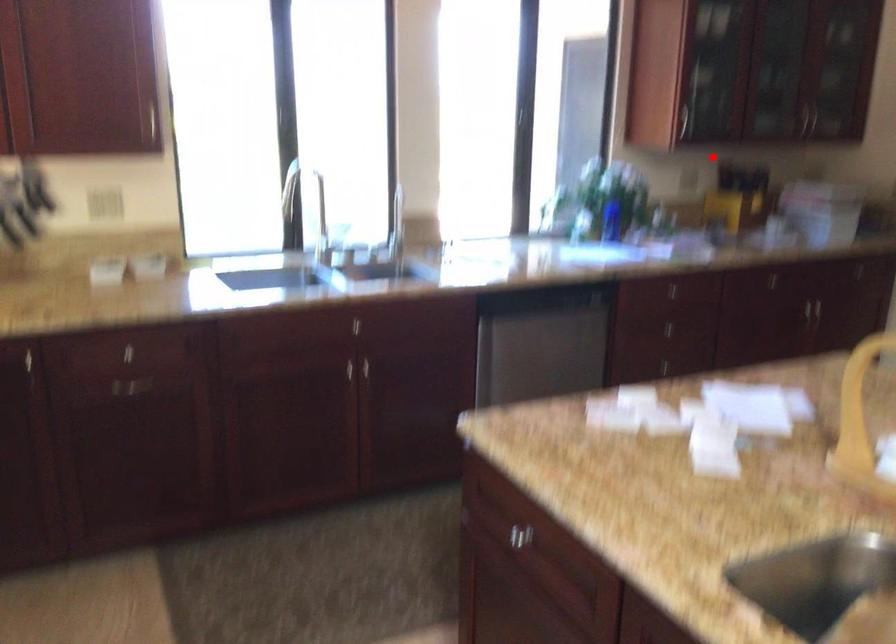
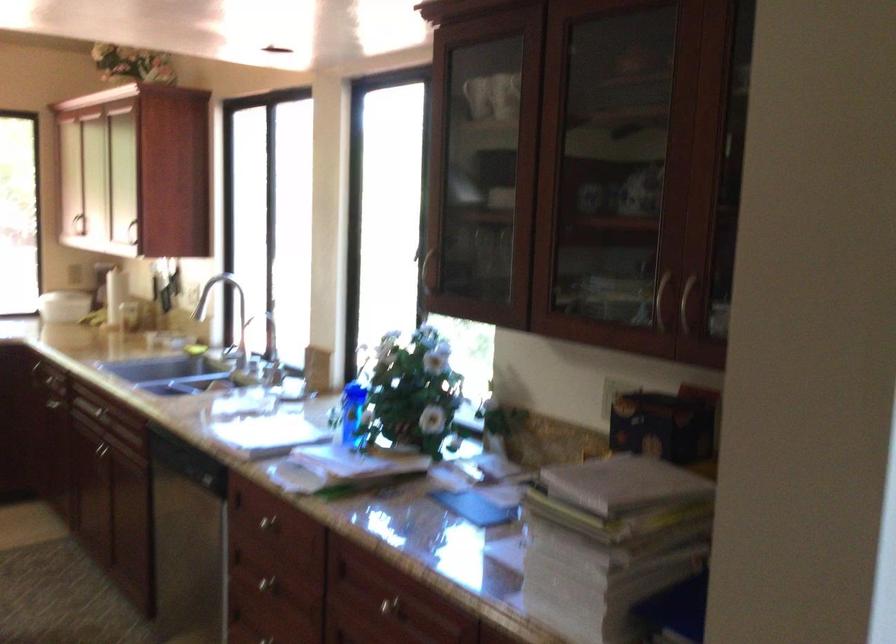
Find the pixel in the second image that matches the highlighted location in the first image.

(614, 393)